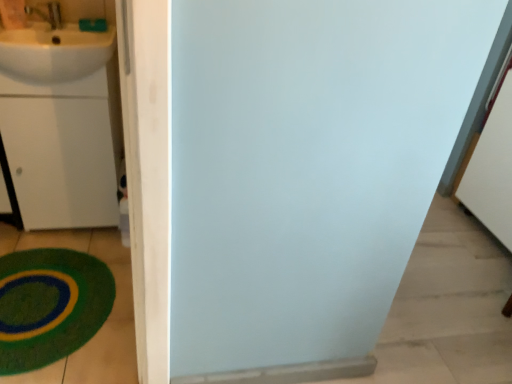
Question: From the image's perspective, is green plush bath mat at lower left located beneath white glossy sink at upper left?

Choices:
 (A) yes
 (B) no

Answer: (A)

Question: Is green plush bath mat at lower left at the left side of white glossy sink at upper left?

Choices:
 (A) no
 (B) yes

Answer: (B)

Question: From the image's perspective, is green plush bath mat at lower left above white glossy sink at upper left?

Choices:
 (A) no
 (B) yes

Answer: (A)

Question: Is green plush bath mat at lower left next to white glossy sink at upper left and touching it?

Choices:
 (A) no
 (B) yes

Answer: (A)

Question: Considering the relative sizes of green plush bath mat at lower left and white glossy sink at upper left in the image provided, is green plush bath mat at lower left shorter than white glossy sink at upper left?

Choices:
 (A) yes
 (B) no

Answer: (A)

Question: From a real-world perspective, is white glossy sink at upper left above or below green plush bath mat at lower left?

Choices:
 (A) below
 (B) above

Answer: (B)

Question: Would you say white glossy sink at upper left is inside or outside green plush bath mat at lower left?

Choices:
 (A) inside
 (B) outside

Answer: (B)

Question: From their relative heights in the image, would you say white glossy sink at upper left is taller or shorter than green plush bath mat at lower left?

Choices:
 (A) tall
 (B) short

Answer: (A)

Question: Considering their positions, is white glossy sink at upper left located in front of or behind green plush bath mat at lower left?

Choices:
 (A) front
 (B) behind

Answer: (B)

Question: Is white matte drawer at left situated inside green plush bath mat at lower left or outside?

Choices:
 (A) outside
 (B) inside

Answer: (A)

Question: From a real-world perspective, relative to green plush bath mat at lower left, is white matte drawer at left vertically above or below?

Choices:
 (A) above
 (B) below

Answer: (A)

Question: From the image's perspective, relative to green plush bath mat at lower left, is white matte drawer at left above or below?

Choices:
 (A) above
 (B) below

Answer: (A)

Question: Is white matte drawer at left in front of or behind green plush bath mat at lower left in the image?

Choices:
 (A) behind
 (B) front

Answer: (A)

Question: Is point (9, 329) positioned closer to the camera than point (34, 77)?

Choices:
 (A) farther
 (B) closer

Answer: (B)

Question: From the image's perspective, relative to white glossy sink at upper left, is green plush bath mat at lower left above or below?

Choices:
 (A) below
 (B) above

Answer: (A)